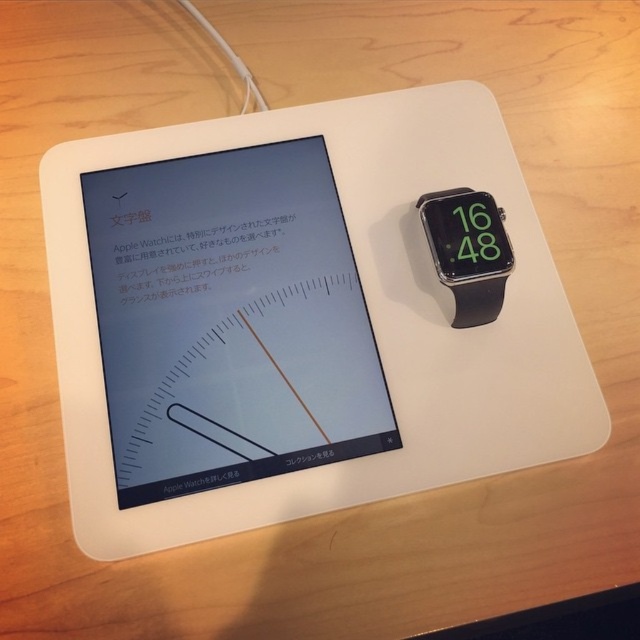
You are a designer who needs to adjust the position of the black rubber watch at upper right so it doesn not block the text on the matte black tablet at left. Can you move it forward or backward?

The matte black tablet at left is in front of the black rubber watch at upper right, so you can move the black rubber watch at upper right backward to avoid blocking the text on the matte black tablet at left.

You are a graphic designer who wants to adjust the watch face design displayed on the matte black tablet at left. To do this, you need to move your cursor to the exact center of the tablet. What are the coordinates you should aim for?

The coordinates to aim for are approximately 0.502 on the x axis and 0.361 on the y axis, as the matte black tablet at left is located at point (230,321).